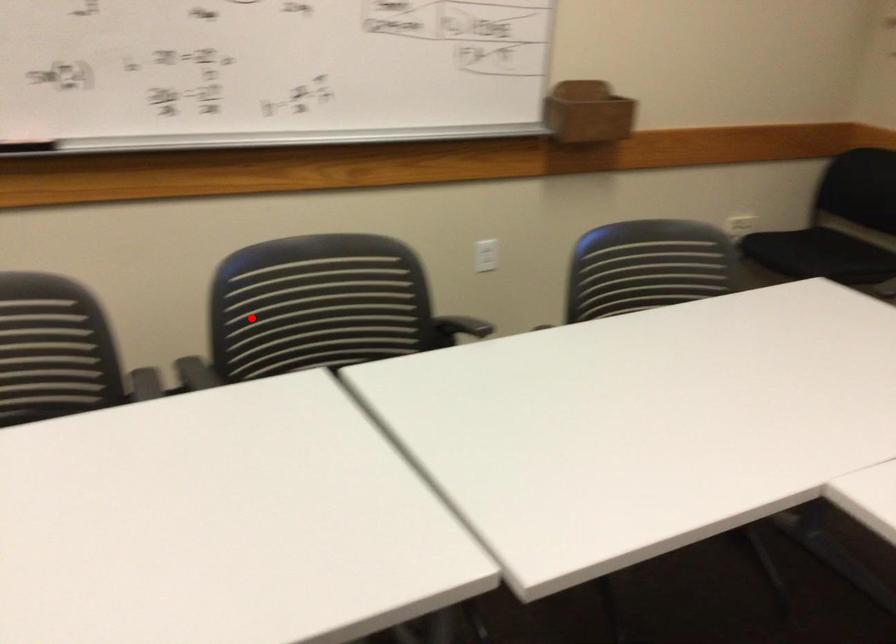
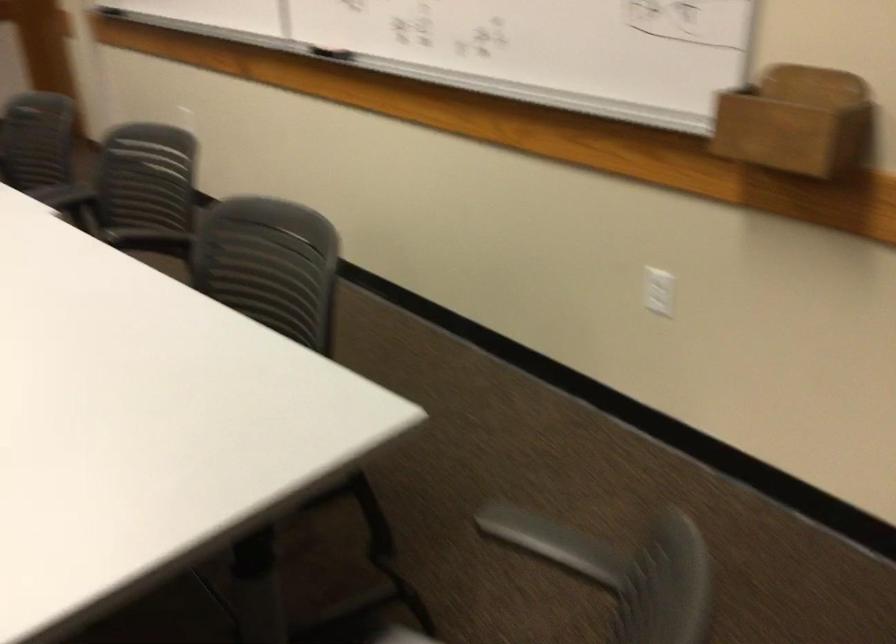
Locate, in the second image, the point that corresponds to the highlighted location in the first image.

(144, 178)